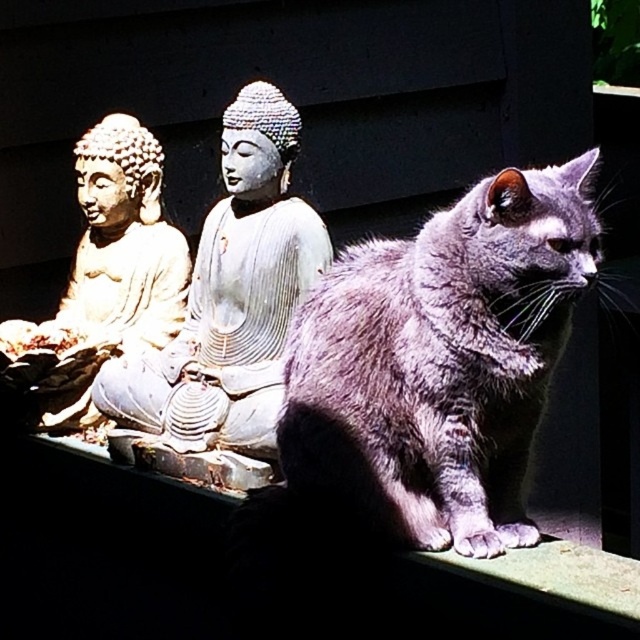
Who is positioned more to the right, satin gray cat at center or gray stone buddha at center?

Positioned to the right is satin gray cat at center.

Is point (362, 451) positioned behind point (316, 232)?

That is False.

Who is more forward, (364, 509) or (236, 406)?

Positioned in front is point (364, 509).

At what (x,y) coordinates should I click in order to perform the action: click on satin gray cat at center. Please return your answer as a coordinate pair (x, y). This screenshot has width=640, height=640. Looking at the image, I should click on (442, 360).

In the scene shown: Is gray stone buddha at center positioned in front of matte gold statue at left?

Yes, gray stone buddha at center is in front of matte gold statue at left.

Looking at this image, does gray stone buddha at center have a smaller size compared to matte gold statue at left?

Incorrect, gray stone buddha at center is not smaller in size than matte gold statue at left.

Between point (221, 220) and point (86, 312), which one is positioned in front?

Point (221, 220)

At what (x,y) coordinates should I click in order to perform the action: click on gray stone buddha at center. Please return your answer as a coordinate pair (x, y). Looking at the image, I should click on (230, 298).

Is satin gray cat at center taller than matte gold statue at left?

Incorrect, satin gray cat at center's height is not larger of matte gold statue at left's.

Measure the distance between satin gray cat at center and camera.

They are 10.20 meters apart.

Which is behind, point (460, 522) or point (152, 346)?

Point (152, 346)

You are a GUI agent. You are given a task and a screenshot of the screen. Output one action in this format:
    pyautogui.click(x=<x>, y=<y>)
    Task: Click on the satin gray cat at center
    This screenshot has width=640, height=640.
    Given the screenshot: What is the action you would take?
    pyautogui.click(x=442, y=360)